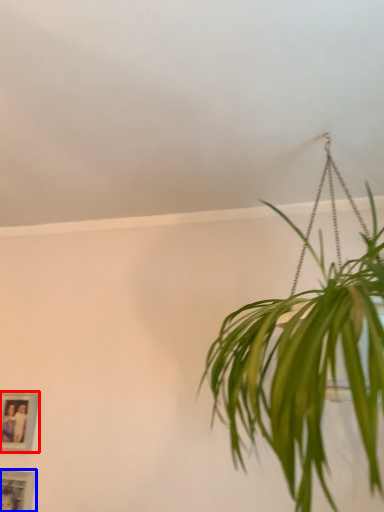
Question: Which object appears closest to the camera in this image, picture frame (highlighted by a red box) or picture frame (highlighted by a blue box)?

Choices:
 (A) picture frame
 (B) picture frame

Answer: (B)